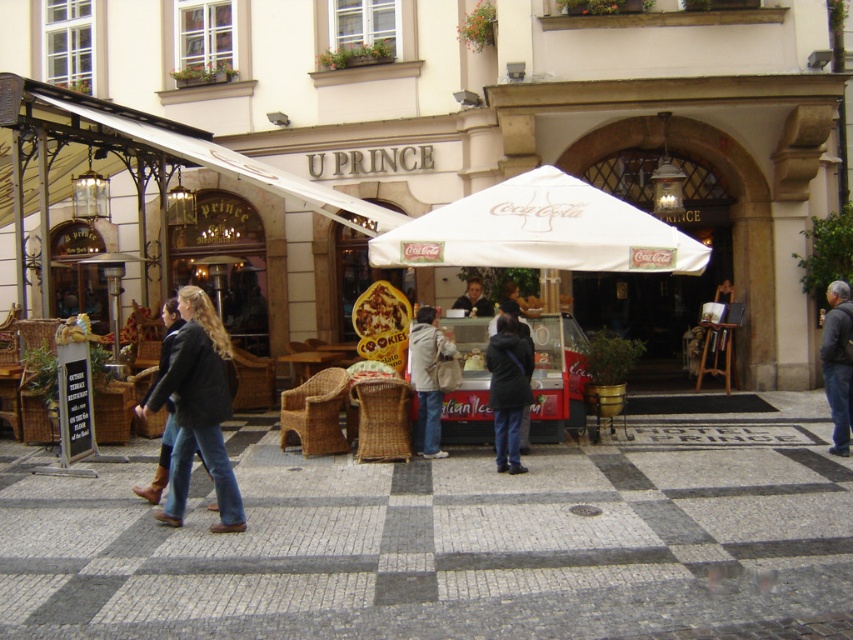
You are standing at the entrance of U Prince and want to find the white fabric umbrella at center. According to the coordinates provided, in which direction should you walk from the entrance to reach it?

The white fabric umbrella at center is located at coordinates point [540,230]. Since the entrance is at the starting point, you should walk towards the direction of the coordinates to reach it.

You are standing at the viewer position in front of the U Prince building. There is a point marked at coordinates point (x=653, y=257). Can you reach that point without moving more than 8 meters from your current position?

The distance between point (x=653, y=257) and the viewer is 8.16 meters, which is slightly more than 8 meters. Therefore, you cannot reach that point without moving more than 8 meters from your current position.

You are a customer standing at the U Prince building entrance. You see a white fabric umbrella at center and a dark brown leather jacket at center. Which object is taller?

The white fabric umbrella at center is much taller than the dark brown leather jacket at center.